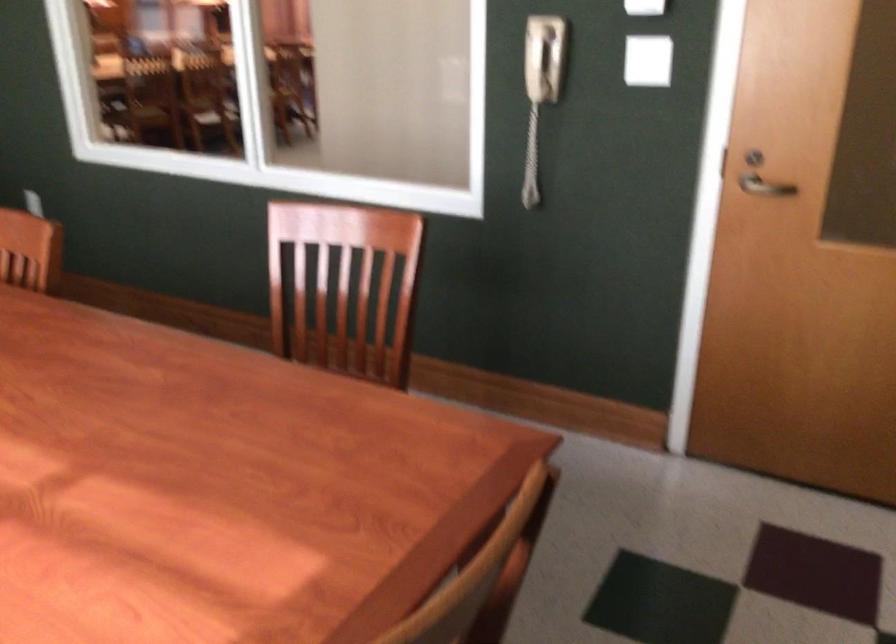
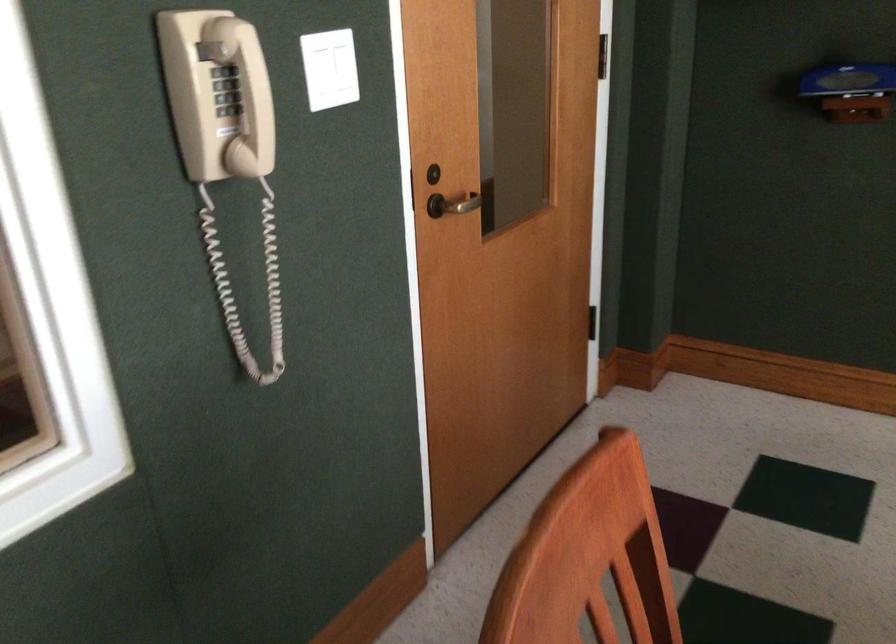
Where in the second image is the point corresponding to (724,165) from the first image?

(409, 191)